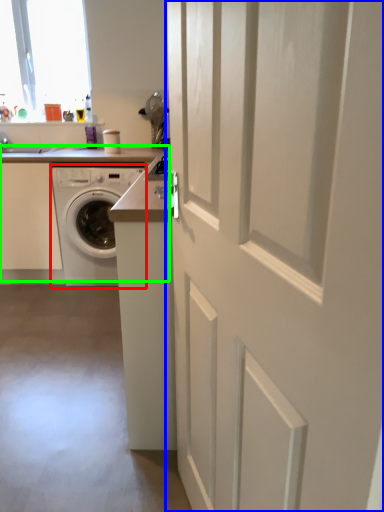
Question: Which object is positioned closest to washing machine (highlighted by a red box)? Select from door (highlighted by a blue box) and appliance (highlighted by a green box).

Choices:
 (A) door
 (B) appliance

Answer: (B)